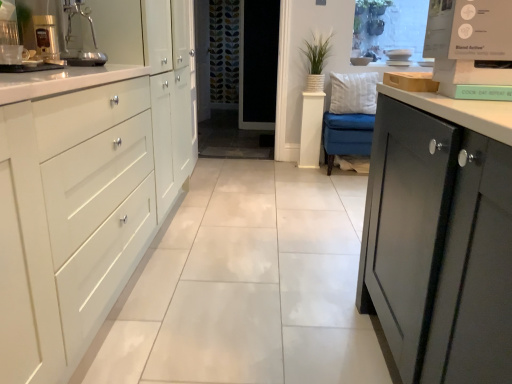
Question: Does metallic silver coffee machine at upper left have a smaller size compared to transparent glass screen door at center?

Choices:
 (A) no
 (B) yes

Answer: (B)

Question: Is metallic silver coffee machine at upper left surrounding transparent glass screen door at center?

Choices:
 (A) yes
 (B) no

Answer: (B)

Question: Does metallic silver coffee machine at upper left turn towards transparent glass screen door at center?

Choices:
 (A) yes
 (B) no

Answer: (B)

Question: Is metallic silver coffee machine at upper left thinner than transparent glass screen door at center?

Choices:
 (A) no
 (B) yes

Answer: (B)

Question: Considering the relative sizes of metallic silver coffee machine at upper left and transparent glass screen door at center in the image provided, is metallic silver coffee machine at upper left bigger than transparent glass screen door at center?

Choices:
 (A) yes
 (B) no

Answer: (B)

Question: From the image's perspective, does metallic silver coffee machine at upper left appear lower than transparent glass screen door at center?

Choices:
 (A) no
 (B) yes

Answer: (B)

Question: Can you see metallic silver coffee machine at upper left touching green woven basket at center?

Choices:
 (A) yes
 (B) no

Answer: (B)

Question: Can you confirm if metallic silver coffee machine at upper left is taller than green woven basket at center?

Choices:
 (A) no
 (B) yes

Answer: (A)

Question: Is metallic silver coffee machine at upper left further to camera compared to green woven basket at center?

Choices:
 (A) no
 (B) yes

Answer: (A)

Question: Considering the relative positions of metallic silver coffee machine at upper left and green woven basket at center in the image provided, is metallic silver coffee machine at upper left to the right of green woven basket at center from the viewer's perspective?

Choices:
 (A) yes
 (B) no

Answer: (B)

Question: From a real-world perspective, is metallic silver coffee machine at upper left on top of green woven basket at center?

Choices:
 (A) yes
 (B) no

Answer: (A)

Question: Considering the relative sizes of metallic silver coffee machine at upper left and green woven basket at center in the image provided, is metallic silver coffee machine at upper left smaller than green woven basket at center?

Choices:
 (A) no
 (B) yes

Answer: (B)

Question: Could you tell me if white glossy cabinet at left is facing transparent glass screen door at center?

Choices:
 (A) no
 (B) yes

Answer: (A)